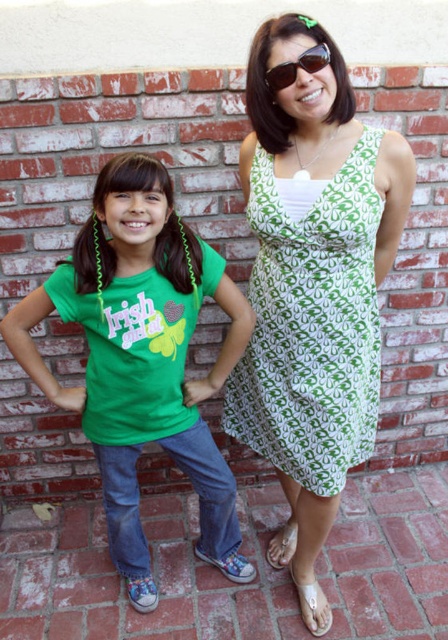
Question: Where is green matte shirt at center located in relation to green printed dress at center in the image?

Choices:
 (A) left
 (B) right

Answer: (A)

Question: Does green matte shirt at center appear over green printed dress at center?

Choices:
 (A) yes
 (B) no

Answer: (B)

Question: In this image, where is green matte shirt at center located relative to green printed dress at center?

Choices:
 (A) left
 (B) right

Answer: (A)

Question: Among these objects, which one is nearest to the camera?

Choices:
 (A) green matte shirt at center
 (B) sunglasses at center
 (C) green printed dress at center

Answer: (B)

Question: Which of the following is the closest to the observer?

Choices:
 (A) sunglasses at center
 (B) green printed dress at center

Answer: (A)

Question: Which point is farther to the camera?

Choices:
 (A) (78, 404)
 (B) (335, 346)

Answer: (A)